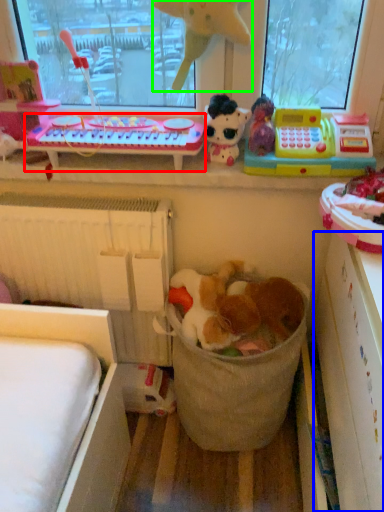
Question: Which object is positioned farthest from changing table (highlighted by a red box)? Select from shelf (highlighted by a blue box) and toy (highlighted by a green box).

Choices:
 (A) shelf
 (B) toy

Answer: (A)